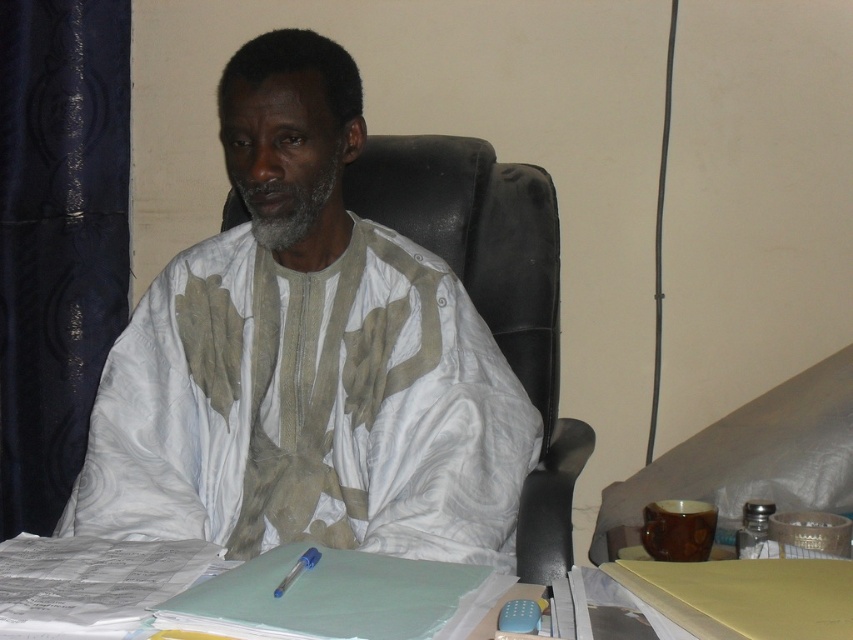
You are organizing a photo shoot and need to ensure that the white cotton shirt at center and the white paper at lower center are clearly visible in the frame. Based on their sizes, which object might require more space in the composition?

The white cotton shirt at center might require more space in the composition since it is wider than the white paper at lower center according to the description.

You are a delivery person who needs to place a small package on the table without disturbing the white cotton shirt at center or the white paper at lower center. Given that the package is 10 inches in length, can you fit it between them?

The white cotton shirt at center is 23.34 inches away from the white paper at lower center. Since the package is only 10 inches long, there is enough space between them to place the package without disturbing either object.